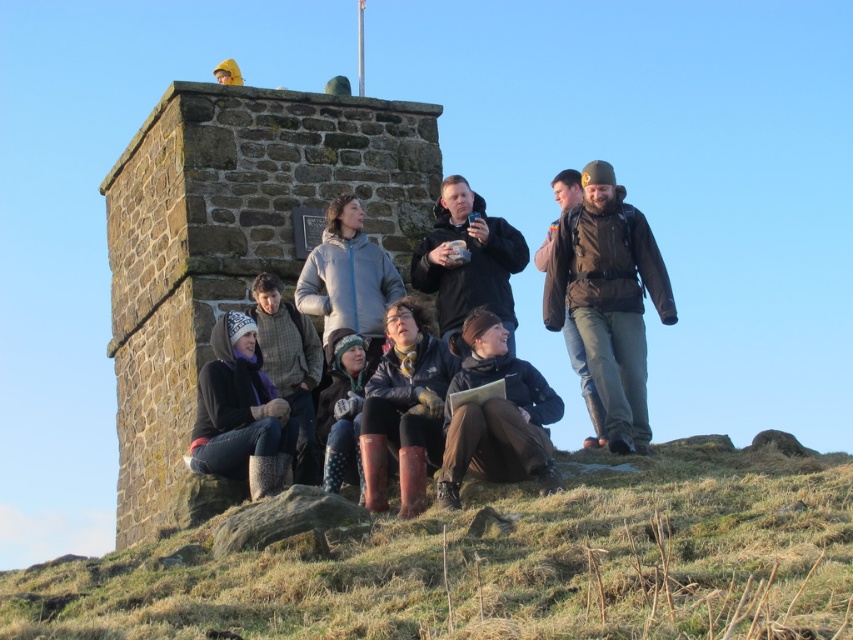
Question: Which point is closer to the camera taking this photo?

Choices:
 (A) (281, 452)
 (B) (769, 483)
 (C) (323, 404)
 (D) (527, 420)

Answer: (B)

Question: Is brown matte jacket at center further to camera compared to knitted wool hat at lower left?

Choices:
 (A) no
 (B) yes

Answer: (B)

Question: Which point is farther from the camera taking this photo?

Choices:
 (A) (648, 266)
 (B) (451, 355)
 (C) (239, 83)
 (D) (344, 218)

Answer: (C)

Question: Based on their relative distances, which object is farther from the matte black jacket at center?

Choices:
 (A) brown matte jacket at center
 (B) brown leather jacket at center
 (C) yellow hooded jacket at center
 (D) knitted wool hat at center

Answer: (C)

Question: Can you confirm if knitted wool hat at lower left is smaller than yellow hooded jacket at center?

Choices:
 (A) no
 (B) yes

Answer: (B)

Question: In this image, where is brown leather jacket at upper right located relative to yellow hooded jacket at center?

Choices:
 (A) right
 (B) left

Answer: (A)